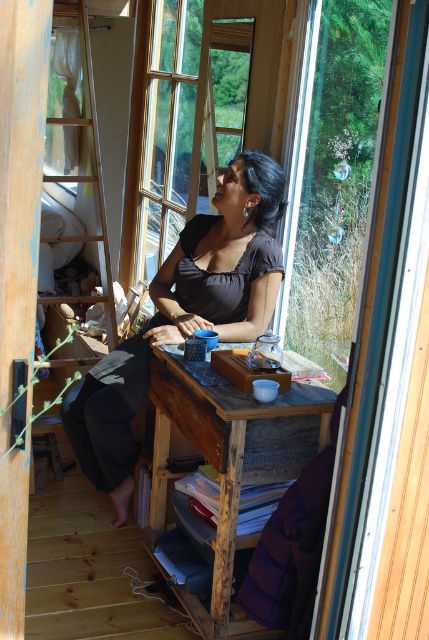
You are organizing a small party and need to place a decorative centerpiece on the wooden table at center. However, you also want to ensure that the matte black shirt at center remains visible. Can the shirt be placed on the table without covering the entire surface?

The matte black shirt at center is wider than the wooden table at center, so placing it on the table would cover the entire surface, making it impossible to keep the shirt visible without overlapping the edges.

You are a painter who needs to reach a high shelf in the room. You see the wooden table at center and the wooden ladder at left. Which object should you use to reach the shelf?

The wooden ladder at left is taller than the wooden table at center, so you should use the wooden ladder at left to reach the high shelf.